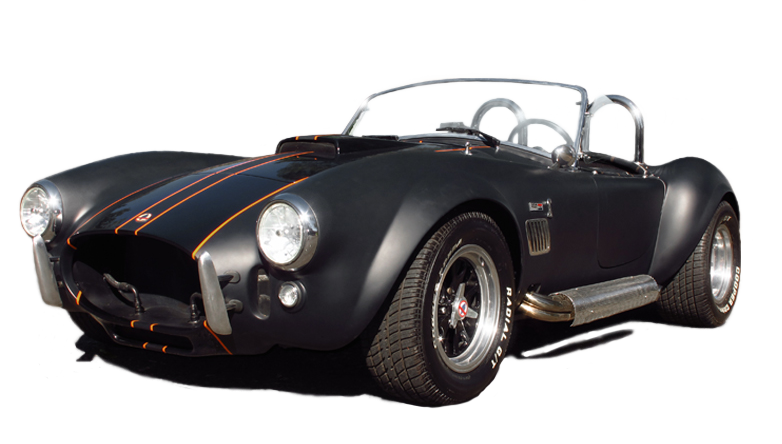
The height and width of the screenshot is (444, 782). What are the coordinates of `light` in the screenshot? It's located at (27, 211).